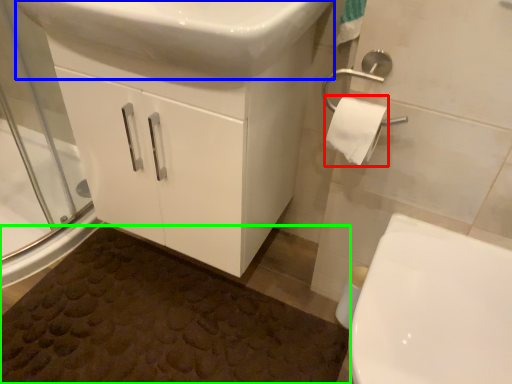
Question: Which object is positioned closest to toilet paper (highlighted by a red box)? Select from sink (highlighted by a blue box) and bath mat (highlighted by a green box).

Choices:
 (A) sink
 (B) bath mat

Answer: (A)